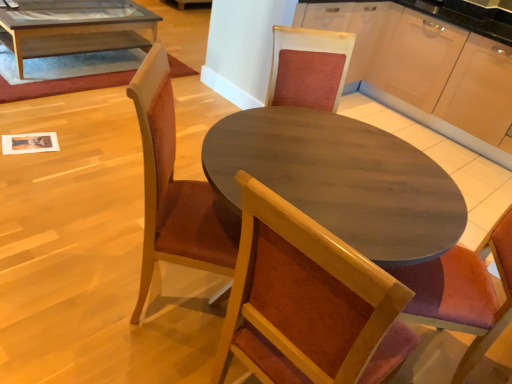
The image size is (512, 384). What are the coordinates of `free space to the left of wooden chair at center` in the screenshot? It's located at (82, 268).